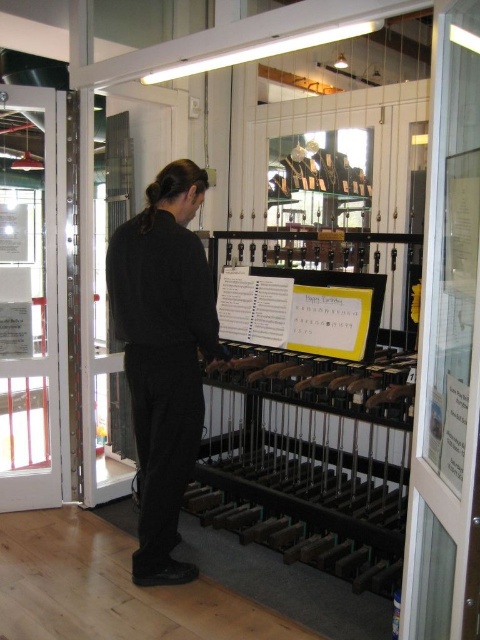
Which is above, transparent glass door at right or black matte pants at center?

transparent glass door at right is above.

The width and height of the screenshot is (480, 640). What do you see at coordinates (447, 349) in the screenshot?
I see `transparent glass door at right` at bounding box center [447, 349].

Where is `transparent glass door at right`? Image resolution: width=480 pixels, height=640 pixels. transparent glass door at right is located at coordinates (447, 349).

Which of these two, black matte pants at center or clear glass door at left, stands shorter?

black matte pants at center

In the scene shown: Measure the distance between black matte pants at center and camera.

black matte pants at center is 2.25 meters away from camera.

This screenshot has width=480, height=640. I want to click on black matte pants at center, so click(164, 355).

You are a GUI agent. You are given a task and a screenshot of the screen. Output one action in this format:
    pyautogui.click(x=<x>, y=<y>)
    Task: Click on the clear glass door at left
    
    Given the screenshot: What is the action you would take?
    pyautogui.click(x=27, y=301)

Does clear glass door at left lie behind yellow paper at center?

That is True.

Between point (48, 278) and point (266, 344), which one is positioned behind?

The point (48, 278) is more distant.

This screenshot has width=480, height=640. Find the location of `clear glass door at left`. clear glass door at left is located at coordinates (27, 301).